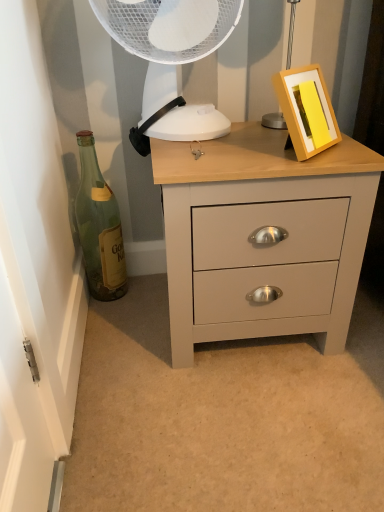
This screenshot has height=512, width=384. Find the location of `free space in front of green glass bottle at left`. free space in front of green glass bottle at left is located at coordinates (115, 328).